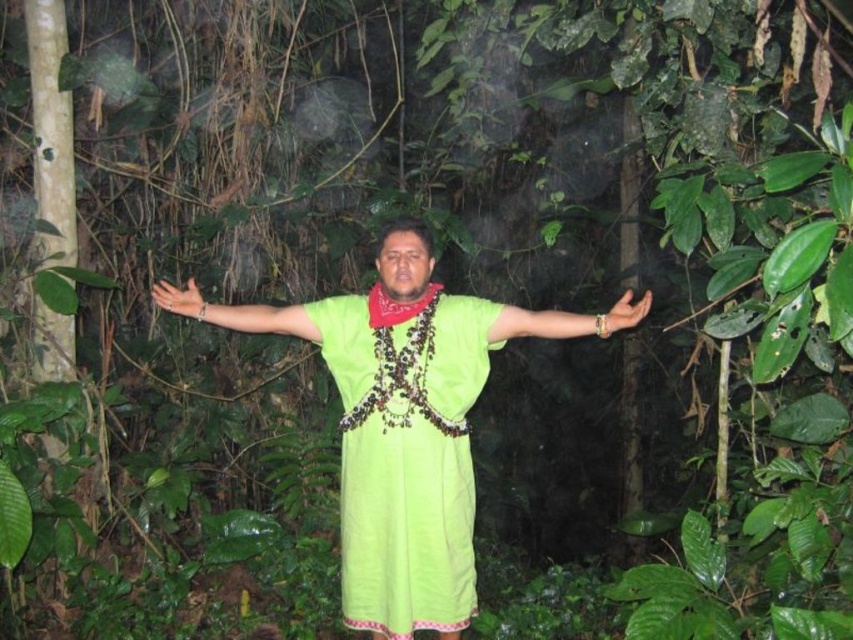
You are a fashion designer observing the person in the forest. You need to determine which item of clothing is bigger between the lime green fabric dress at center and the green fabric arm at center. Which one is larger?

The lime green fabric dress at center has a larger size compared to the green fabric arm at center, so the dress is bigger.

You are a photographer trying to capture the perfect shot of the lime green fabric dress at center and the green fabric arm at center. Based on their positions, which object should you focus on first to ensure both are in frame without moving the camera?

You should focus on the lime green fabric dress at center first because it is to the left of the green fabric arm at center, so by centering the dress, the arm will naturally be within the frame as well.